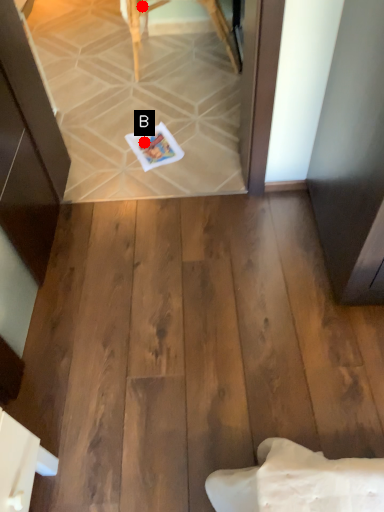
Question: Two points are circled on the image, labeled by A and B beside each circle. Which point is closer to the camera?

Choices:
 (A) A is closer
 (B) B is closer

Answer: (B)